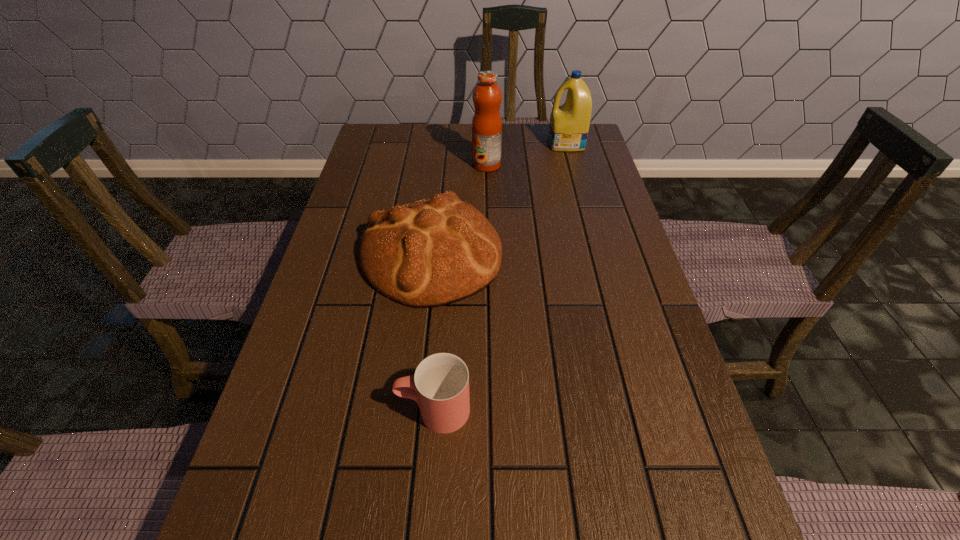
Locate an element on the screen. The width and height of the screenshot is (960, 540). the third nearest object is located at coordinates (487, 96).

Find the location of a particular element. The image size is (960, 540). fruit juice is located at coordinates coord(487,96).

Where is `the third shortest object`? the third shortest object is located at coordinates (569, 124).

This screenshot has width=960, height=540. What are the coordinates of `the farthest object` in the screenshot? It's located at (569, 124).

Locate an element on the screen. the third farthest object is located at coordinates (433, 252).

Identify the location of cup. The image size is (960, 540). (440, 386).

What are the coordinates of `free space located 0.140m on the front label of the tallest object` in the screenshot? It's located at (428, 165).

Find the location of a particular element. vacant space positioned on the front label of the tallest object is located at coordinates (367, 165).

Find the location of `vacant region located 0.210m on the front label of the tallest object`. vacant region located 0.210m on the front label of the tallest object is located at coordinates (405, 165).

Find the location of a particular element. Image resolution: width=960 pixels, height=540 pixels. vacant region located 0.070m on the label of the rightmost object is located at coordinates (527, 144).